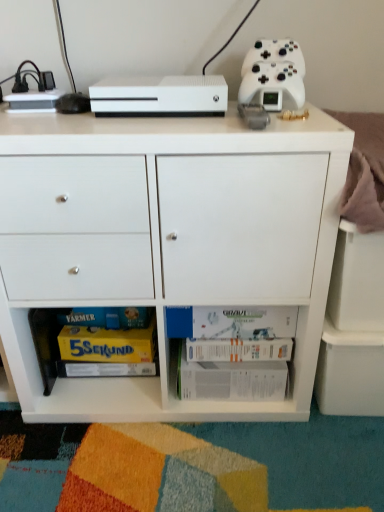
I want to click on blank space above white matte board game at lower center, placed as the 2th book when sorted from bottom to top (from a real-world perspective), so click(x=233, y=317).